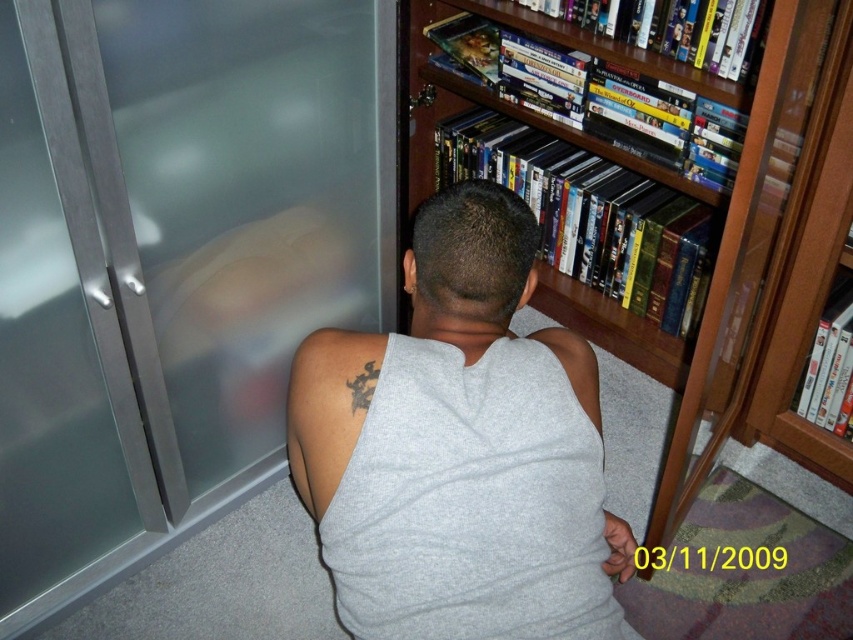
You are a delivery person who needs to deliver a package to the person shown. The package must be placed on the wooden bookshelf at upper right or the black ink tattoo at upper back. Which location is physically reachable for placement?

The wooden bookshelf at upper right is closer to the viewer than the black ink tattoo at upper back, so the delivery person can reach the wooden bookshelf at upper right but cannot reach the black ink tattoo at upper back.

You are a delivery person who needs to enter the room through the frosted glass door at left. However, you notice the gray cotton tank top at center is blocking the door handle. Can you still access the door handle to open the door?

The frosted glass door at left is bigger than the gray cotton tank top at center, so the tank top might not fully block the door handle. You should still be able to access the door handle to open the door.